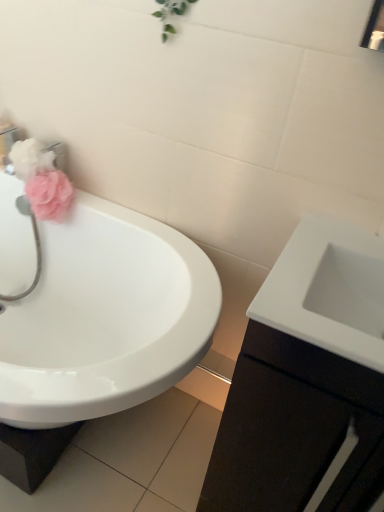
The width and height of the screenshot is (384, 512). I want to click on white glossy sink at left, the second sink in the right-to-left sequence, so click(104, 317).

Where is `pink fabric at left`? This screenshot has width=384, height=512. pink fabric at left is located at coordinates (18, 237).

The image size is (384, 512). Find the location of `white glossy sink at left, the second sink in the right-to-left sequence`. white glossy sink at left, the second sink in the right-to-left sequence is located at coordinates (104, 317).

Is pink fabric at left touching matte pink sponge at left, which ranks as the 1th flower in bottom-to-top order?

They are not placed beside each other.

In the scene shown: From a real-world perspective, is pink fabric at left under matte pink sponge at left, which ranks as the 1th flower in bottom-to-top order?

Yes, from a real-world perspective, pink fabric at left is under matte pink sponge at left, which ranks as the 1th flower in bottom-to-top order.

From the picture: Between pink fabric at left and matte pink sponge at left, which ranks as the 1th flower in bottom-to-top order, which one appears on the left side from the viewer's perspective?

pink fabric at left is more to the left.

From the image's perspective, is white glossy sink at right, the first sink when ordered from right to left, located above or below matte pink sponge at left, the 2th flower in the top-to-bottom sequence?

From the image's perspective, white glossy sink at right, the first sink when ordered from right to left, appears below matte pink sponge at left, the 2th flower in the top-to-bottom sequence.

Considering the positions of objects white glossy sink at right, the first sink when ordered from right to left, and matte pink sponge at left, which ranks as the 1th flower in bottom-to-top order, in the image provided, who is behind, white glossy sink at right, the first sink when ordered from right to left, or matte pink sponge at left, which ranks as the 1th flower in bottom-to-top order,?

matte pink sponge at left, which ranks as the 1th flower in bottom-to-top order, is further away from the camera.

You are a GUI agent. You are given a task and a screenshot of the screen. Output one action in this format:
    pyautogui.click(x=<x>, y=<y>)
    Task: Click on the sink positioned vertically above the matte pink sponge at left, the 2th flower in the top-to-bottom sequence (from a real-world perspective)
    This screenshot has height=512, width=384.
    Given the screenshot: What is the action you would take?
    pyautogui.click(x=328, y=291)

From the image's perspective, who appears lower, matte pink flower at left, positioned as the second flower in bottom-to-top order, or white glossy sink at right, the first sink when ordered from right to left?

white glossy sink at right, the first sink when ordered from right to left, from the image's perspective.

Is white glossy sink at right, the second sink in the left-to-right sequence, surrounded by matte pink flower at left, positioned as the second flower in bottom-to-top order?

Actually, white glossy sink at right, the second sink in the left-to-right sequence, is outside matte pink flower at left, positioned as the second flower in bottom-to-top order.

Is matte pink flower at left, the 1th flower from the top, not close to white glossy sink at right, the second sink in the left-to-right sequence?

No, matte pink flower at left, the 1th flower from the top, is in close proximity to white glossy sink at right, the second sink in the left-to-right sequence.

From the image's perspective, is matte pink flower at left, positioned as the second flower in bottom-to-top order, over pink fabric at left?

Correct, matte pink flower at left, positioned as the second flower in bottom-to-top order, appears higher than pink fabric at left in the image.

Can you tell me how much matte pink flower at left, the 1th flower from the top, and pink fabric at left differ in facing direction?

The angle between the facing direction of matte pink flower at left, the 1th flower from the top, and the facing direction of pink fabric at left is 84.8 degrees.

In the scene shown: Looking at the image, does matte pink flower at left, positioned as the second flower in bottom-to-top order, seem bigger or smaller compared to pink fabric at left?

Clearly, matte pink flower at left, positioned as the second flower in bottom-to-top order, is smaller in size than pink fabric at left.

From a real-world perspective, is matte pink flower at left, positioned as the second flower in bottom-to-top order, over pink fabric at left?

Yes, from a real-world perspective, matte pink flower at left, positioned as the second flower in bottom-to-top order, is above pink fabric at left.

Considering the sizes of objects white glossy cabinet at right and white glossy sink at right, the second sink in the left-to-right sequence, in the image provided, who is taller, white glossy cabinet at right or white glossy sink at right, the second sink in the left-to-right sequence,?

Standing taller between the two is white glossy cabinet at right.

Consider the image. How much distance is there between white glossy cabinet at right and white glossy sink at right, the first sink when ordered from right to left?

The distance of white glossy cabinet at right from white glossy sink at right, the first sink when ordered from right to left, is 10.06 inches.

Would you say white glossy cabinet at right contains white glossy sink at right, the first sink when ordered from right to left?

Yes, white glossy cabinet at right is surrounding white glossy sink at right, the first sink when ordered from right to left.

Considering the sizes of objects white glossy cabinet at right and white glossy sink at right, the first sink when ordered from right to left, in the image provided, who is bigger, white glossy cabinet at right or white glossy sink at right, the first sink when ordered from right to left,?

white glossy cabinet at right is bigger.

From the picture: Based on their sizes in the image, would you say white glossy sink at left, the second sink in the right-to-left sequence, is bigger or smaller than matte pink sponge at left, the 2th flower in the top-to-bottom sequence?

Considering their sizes, white glossy sink at left, the second sink in the right-to-left sequence, takes up more space than matte pink sponge at left, the 2th flower in the top-to-bottom sequence.

From the image's perspective, is white glossy sink at left, marked as the first sink in a left-to-right arrangement, over matte pink sponge at left, which ranks as the 1th flower in bottom-to-top order?

No, from the image's perspective, white glossy sink at left, marked as the first sink in a left-to-right arrangement, is not on top of matte pink sponge at left, which ranks as the 1th flower in bottom-to-top order.

Measure the distance between white glossy sink at left, marked as the first sink in a left-to-right arrangement, and matte pink sponge at left, which ranks as the 1th flower in bottom-to-top order.

white glossy sink at left, marked as the first sink in a left-to-right arrangement, is 12.80 inches away from matte pink sponge at left, which ranks as the 1th flower in bottom-to-top order.

Locate an element on the screen. Image resolution: width=384 pixels, height=512 pixels. bathroom cabinet located underneath the pink fabric at left (from a real-world perspective) is located at coordinates (x=295, y=429).

Would you say pink fabric at left is outside white glossy cabinet at right?

Yes, pink fabric at left is located beyond the bounds of white glossy cabinet at right.

Can you tell me how much pink fabric at left and white glossy cabinet at right differ in facing direction?

1.35 degrees separate the facing orientations of pink fabric at left and white glossy cabinet at right.

Does pink fabric at left lie behind white glossy cabinet at right?

Yes, it is.

What are the coordinates of `plumbing fixture located below the matte pink sponge at left, the 2th flower in the top-to-bottom sequence (from the image's perspective)` in the screenshot? It's located at pos(18,237).

Starting from the white glossy sink at right, the first sink when ordered from right to left, which flower is the 1st one behind? Please provide its 2D coordinates.

[(50, 195)]

Which object lies further to the anchor point white glossy sink at right, the first sink when ordered from right to left, matte pink flower at left, positioned as the second flower in bottom-to-top order, or matte pink sponge at left, which ranks as the 1th flower in bottom-to-top order?

matte pink flower at left, positioned as the second flower in bottom-to-top order, lies further to white glossy sink at right, the first sink when ordered from right to left, than the other object.

Estimate the real-world distances between objects in this image. Which object is further from white glossy sink at right, the second sink in the left-to-right sequence, white glossy cabinet at right or white glossy sink at left, the second sink in the right-to-left sequence?

white glossy sink at left, the second sink in the right-to-left sequence.

Based on the photo, which object lies further to the anchor point white glossy sink at right, the second sink in the left-to-right sequence, matte pink flower at left, the 1th flower from the top, or pink fabric at left?

pink fabric at left lies further to white glossy sink at right, the second sink in the left-to-right sequence, than the other object.

Considering their positions, is white glossy sink at left, marked as the first sink in a left-to-right arrangement, positioned further to pink fabric at left than white glossy cabinet at right?

white glossy cabinet at right is positioned further to the anchor pink fabric at left.

When comparing their distances from matte pink flower at left, positioned as the second flower in bottom-to-top order, does white glossy cabinet at right or white glossy sink at right, the first sink when ordered from right to left, seem further?

white glossy cabinet at right is further to matte pink flower at left, positioned as the second flower in bottom-to-top order.

When comparing their distances from matte pink flower at left, positioned as the second flower in bottom-to-top order, does pink fabric at left or white glossy sink at left, marked as the first sink in a left-to-right arrangement, seem closer?

Among the two, pink fabric at left is located nearer to matte pink flower at left, positioned as the second flower in bottom-to-top order.

When comparing their distances from matte pink sponge at left, the 2th flower in the top-to-bottom sequence, does white glossy sink at right, the first sink when ordered from right to left, or pink fabric at left seem closer?

The object closer to matte pink sponge at left, the 2th flower in the top-to-bottom sequence, is pink fabric at left.

Which object lies nearer to the anchor point white glossy sink at right, the second sink in the left-to-right sequence, white glossy cabinet at right or pink fabric at left?

The object closer to white glossy sink at right, the second sink in the left-to-right sequence, is white glossy cabinet at right.

The image size is (384, 512). Find the location of `flower between matte pink flower at left, the 1th flower from the top, and white glossy cabinet at right`. flower between matte pink flower at left, the 1th flower from the top, and white glossy cabinet at right is located at coordinates (50, 195).

The image size is (384, 512). What are the coordinates of `flower between white glossy sink at left, the second sink in the right-to-left sequence, and matte pink flower at left, the 1th flower from the top, in the front-back direction` in the screenshot? It's located at click(x=50, y=195).

Identify the location of plumbing fixture positioned between white glossy sink at left, the second sink in the right-to-left sequence, and matte pink flower at left, positioned as the second flower in bottom-to-top order, from near to far. (18, 237).

Find the location of a particular element. Image resolution: width=384 pixels, height=512 pixels. flower situated between white glossy sink at left, the second sink in the right-to-left sequence, and white glossy sink at right, the second sink in the left-to-right sequence, from left to right is located at coordinates (50, 195).